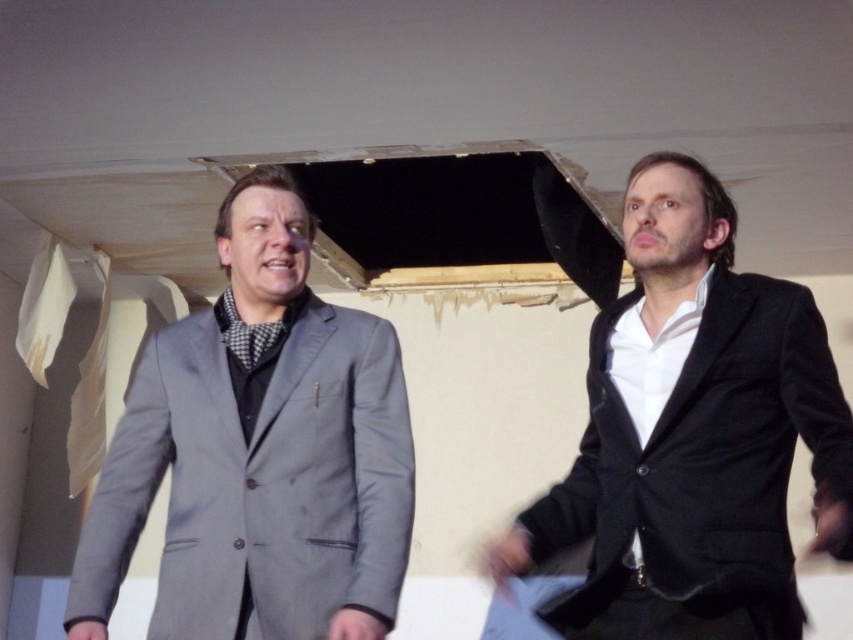
You are an interior designer observing the scene. You need to place a decorative item exactly at the center of the room. The gray wool suit at center is currently occupying a specific location. Where should you place the decorative item to ensure it is at the true center of the room?

The gray wool suit at center is located at point (259,452), so the true center of the room would be at point (426,320). Therefore, you should place the decorative item at the center coordinates of (426,320) to ensure it is at the true center of the room.

You are an interior designer observing the scene. You need to place a decorative item between the gray wool suit at center and the black velvet suit at right. Where should you place it to ensure it is equidistant from both suits?

Since the gray wool suit at center is to the left of the black velvet suit at right, placing the decorative item exactly halfway between them would ensure it is equidistant from both suits.

You are a tailor measuring suits for alterations. You have two suits in front of you, the gray wool suit at center and the black velvet suit at right. Which suit is shorter in height?

The gray wool suit at center is not as tall as the black velvet suit at right, so the gray wool suit at center is shorter in height.